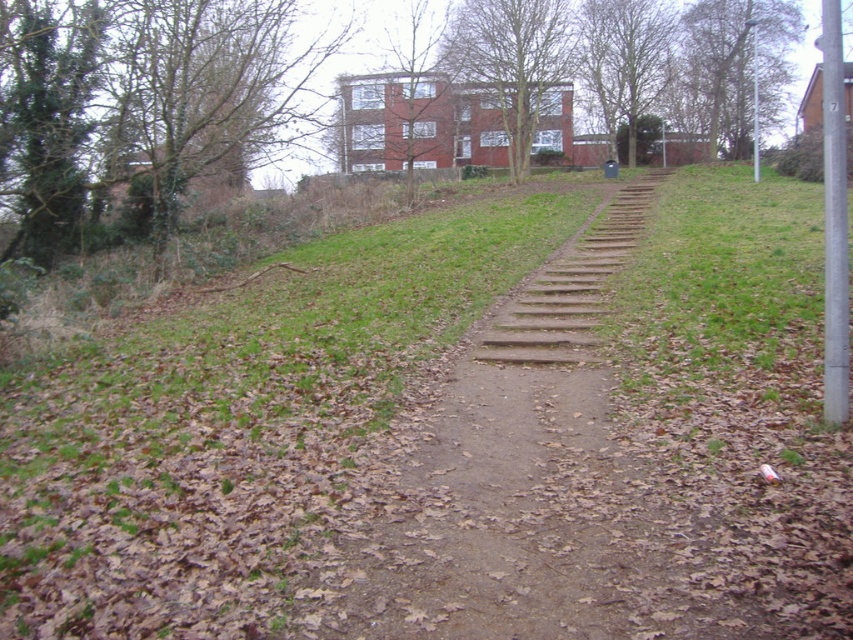
Question: Which object is positioned closest to the wooden stairs at center?

Choices:
 (A) green grassy at center
 (B) dirt path at center

Answer: (B)

Question: Does dirt path at center lie in front of wooden stairs at center?

Choices:
 (A) no
 (B) yes

Answer: (B)

Question: Which object is farther from the camera taking this photo?

Choices:
 (A) green grassy at center
 (B) dirt path at center
 (C) wooden stairs at center

Answer: (C)

Question: Based on their relative distances, which object is farther from the green grassy at center?

Choices:
 (A) dirt path at center
 (B) wooden stairs at center

Answer: (B)

Question: Can you confirm if green grassy at center is wider than dirt path at center?

Choices:
 (A) yes
 (B) no

Answer: (A)

Question: Is green grassy at center bigger than wooden stairs at center?

Choices:
 (A) yes
 (B) no

Answer: (A)